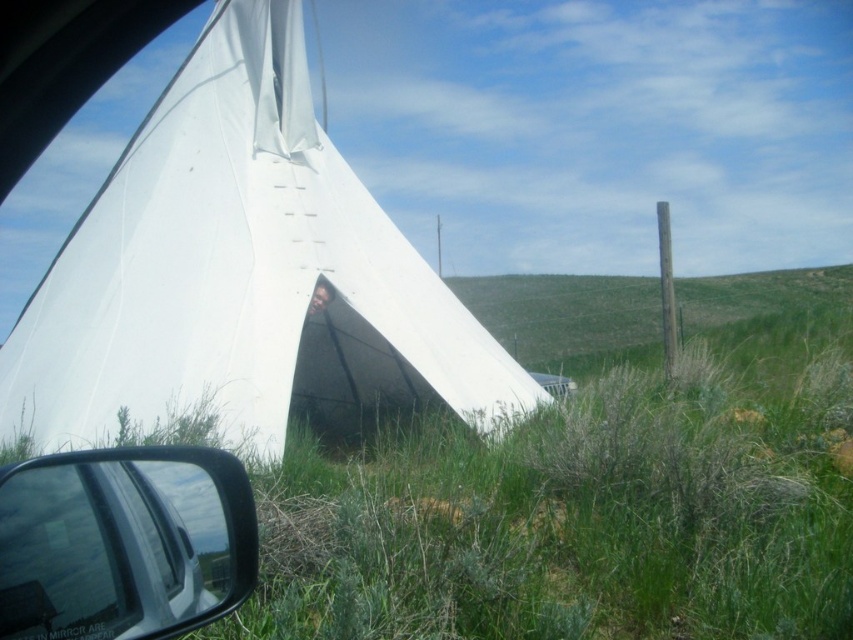
Who is higher up, white canvas tent at center or black plastic side mirror at lower left?

Positioned higher is white canvas tent at center.

Can you confirm if white canvas tent at center is shorter than black plastic side mirror at lower left?

No, white canvas tent at center is not shorter than black plastic side mirror at lower left.

Which is in front, point (230, 8) or point (86, 477)?

Point (86, 477)

Identify the location of white canvas tent at center. (242, 276).